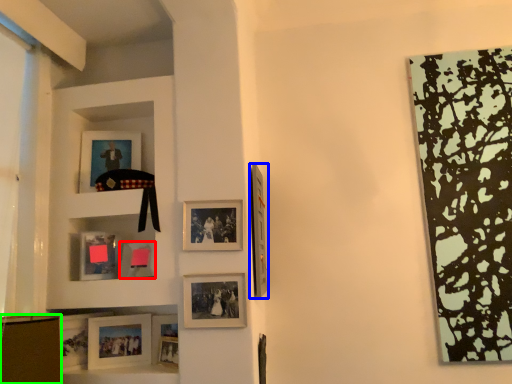
Question: Which object is the farthest from picture frame (highlighted by a red box)? Choose among these: picture frame (highlighted by a blue box) or shelf (highlighted by a green box).

Choices:
 (A) picture frame
 (B) shelf

Answer: (A)